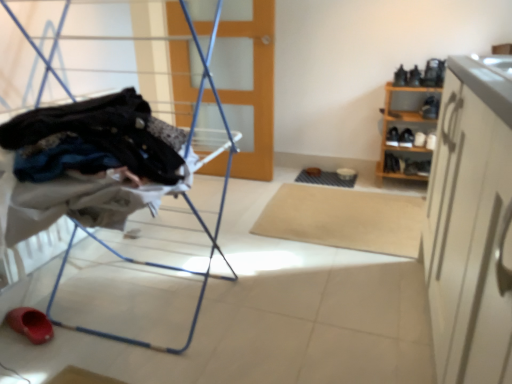
Identify the location of vacant space behind rubber/soft sole shoe at lower left. Image resolution: width=512 pixels, height=384 pixels. (65, 296).